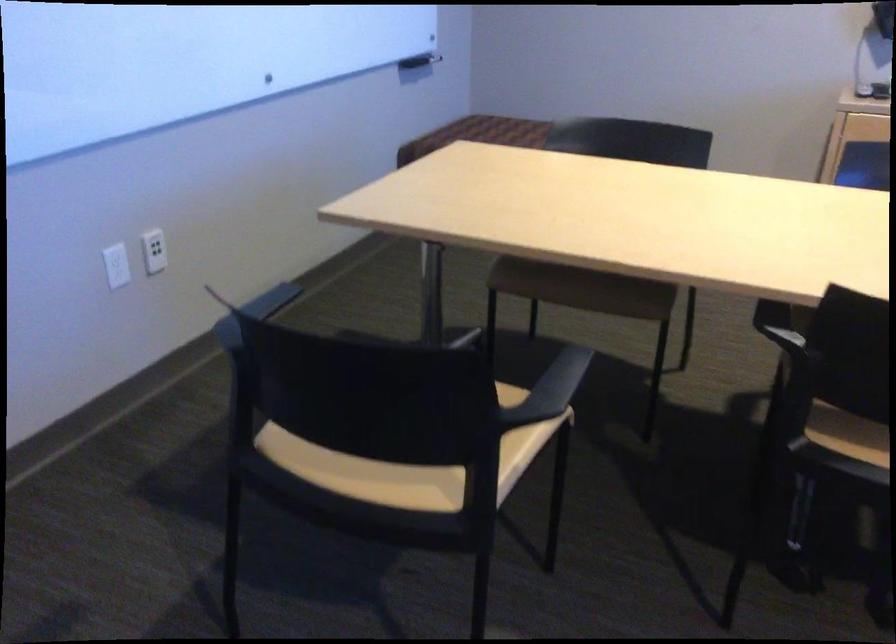
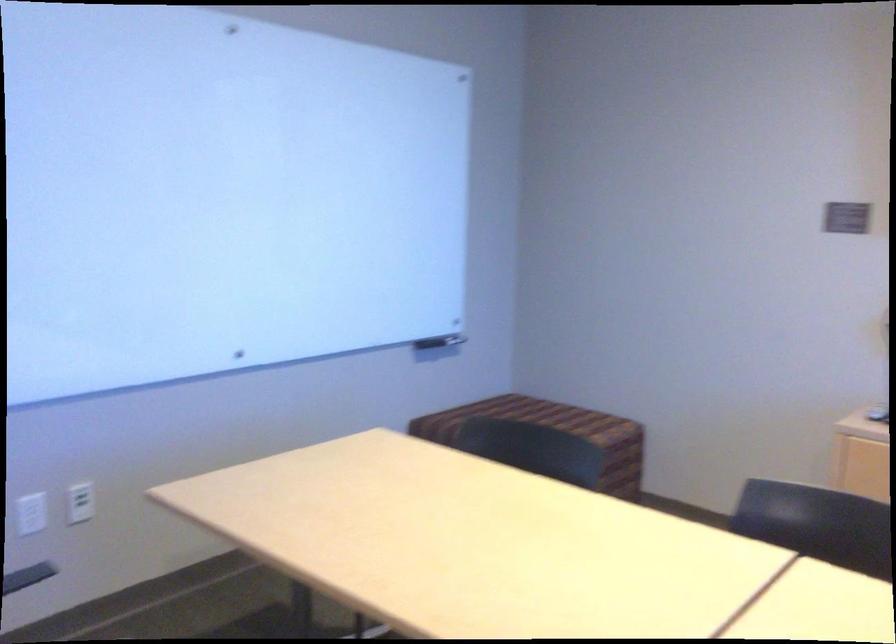
Find the pixel in the second image that matches point (150, 249) in the first image.

(80, 502)